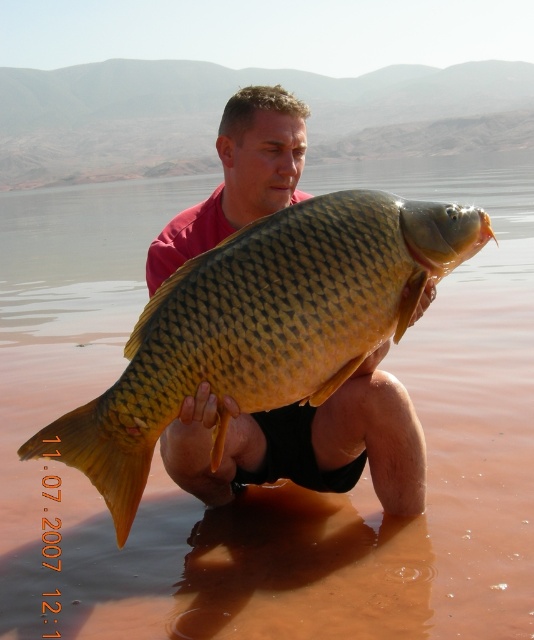
Does golden scaly fish at center appear on the left side of matte yellow fish at center?

Yes, golden scaly fish at center is to the left of matte yellow fish at center.

Can you confirm if golden scaly fish at center is positioned below matte yellow fish at center?

Incorrect, golden scaly fish at center is not positioned below matte yellow fish at center.

Who is more distant from viewer, (x=162, y=396) or (x=286, y=193)?

Positioned behind is point (x=286, y=193).

Locate an element on the screen. golden scaly fish at center is located at coordinates (263, 324).